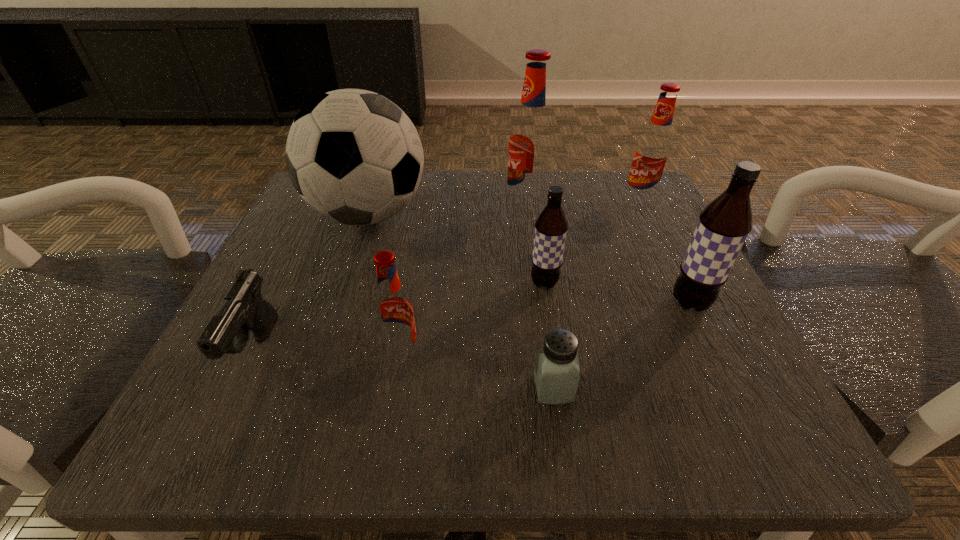
The height and width of the screenshot is (540, 960). I want to click on vacant area located on the front of the tallest root beer, so click(x=540, y=303).

You are a GUI agent. You are given a task and a screenshot of the screen. Output one action in this format:
    pyautogui.click(x=<x>, y=<y>)
    Task: Click on the vacant position located 0.270m on the main logo of the black soccer ball
    The image size is (960, 540).
    Given the screenshot: What is the action you would take?
    pyautogui.click(x=563, y=214)

You are a GUI agent. You are given a task and a screenshot of the screen. Output one action in this format:
    pyautogui.click(x=<x>, y=<y>)
    Task: Click on the vacant region located 0.060m on the back of the second smallest red root beer
    
    Given the screenshot: What is the action you would take?
    [x=628, y=180]

The image size is (960, 540). In order to click on vacant region located 0.320m on the back of the right brown root beer in this screenshot , I will do `click(633, 187)`.

You are a GUI agent. You are given a task and a screenshot of the screen. Output one action in this format:
    pyautogui.click(x=<x>, y=<y>)
    Task: Click on the vacant position located on the left of the left brown root beer
    This screenshot has width=960, height=540.
    Given the screenshot: What is the action you would take?
    pyautogui.click(x=361, y=284)

Locate an element on the screen. The image size is (960, 540). blank space located 0.300m on the right of the nearest root beer is located at coordinates (631, 354).

In order to click on vacant area located 0.110m on the right of the saltshaker in this screenshot , I will do `click(655, 388)`.

At what (x,y) coordinates should I click in order to perform the action: click on soccer ball located in the far edge section of the desktop. Please return your answer as a coordinate pair (x, y). This screenshot has width=960, height=540. Looking at the image, I should click on (354, 156).

Where is `pistol present at the near edge`? This screenshot has height=540, width=960. pistol present at the near edge is located at coordinates (244, 309).

Locate an element on the screen. This screenshot has height=540, width=960. saltshaker present at the near edge is located at coordinates (556, 372).